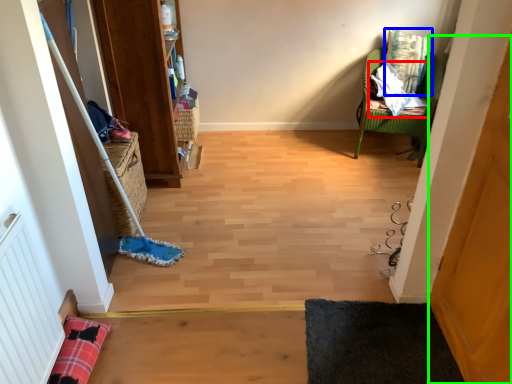
Question: Based on their relative distances, which object is farther from material (highlighted by a red box)? Choose from pillow (highlighted by a blue box) and screen door (highlighted by a green box).

Choices:
 (A) pillow
 (B) screen door

Answer: (B)